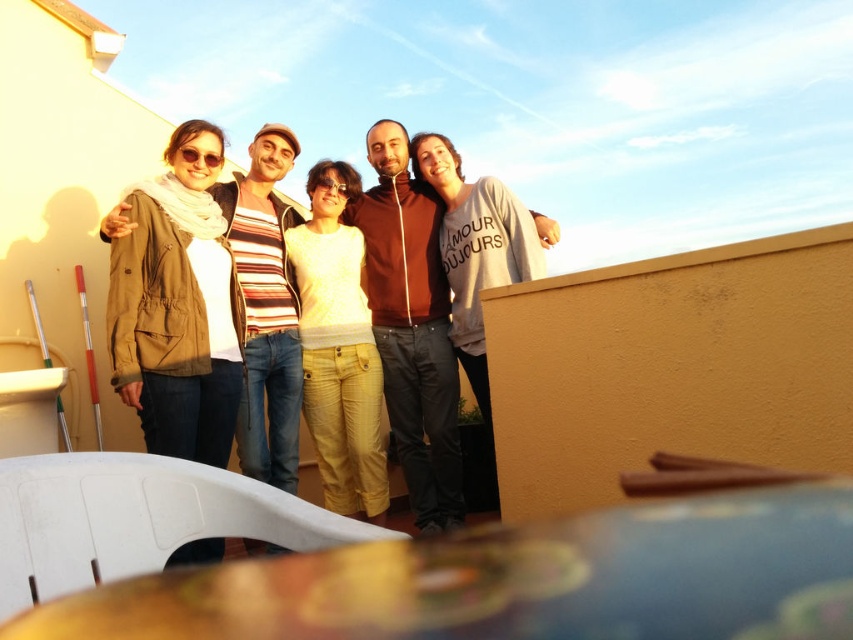
Is khaki cotton jacket at center bigger than gray cotton sweatshirt at center?

Result: Incorrect, khaki cotton jacket at center is not larger than gray cotton sweatshirt at center.

Who is more forward, (183, 141) or (440, 225)?

Point (183, 141)

Is point (190, 349) positioned before point (494, 472)?

Yes, point (190, 349) is closer to viewer.

This screenshot has width=853, height=640. Identify the location of khaki cotton jacket at center. (173, 336).

Can you confirm if light yellow corduroy pants at center is smaller than gray cotton sweatshirt at center?

Yes, light yellow corduroy pants at center is smaller than gray cotton sweatshirt at center.

Does point (332, 252) lie in front of point (518, 269)?

No, it is not.

Where is `light yellow corduroy pants at center`? This screenshot has height=640, width=853. light yellow corduroy pants at center is located at coordinates (338, 348).

Is khaki cotton jacket at center shorter than matte brown jacket at center?

Yes, khaki cotton jacket at center is shorter than matte brown jacket at center.

Can you confirm if khaki cotton jacket at center is wider than matte brown jacket at center?

No, khaki cotton jacket at center is not wider than matte brown jacket at center.

Is point (148, 204) positioned behind point (405, 257)?

No, (148, 204) is closer to viewer.

You are a GUI agent. You are given a task and a screenshot of the screen. Output one action in this format:
    pyautogui.click(x=<x>, y=<y>)
    Task: Click on the khaki cotton jacket at center
    
    Given the screenshot: What is the action you would take?
    pyautogui.click(x=173, y=336)